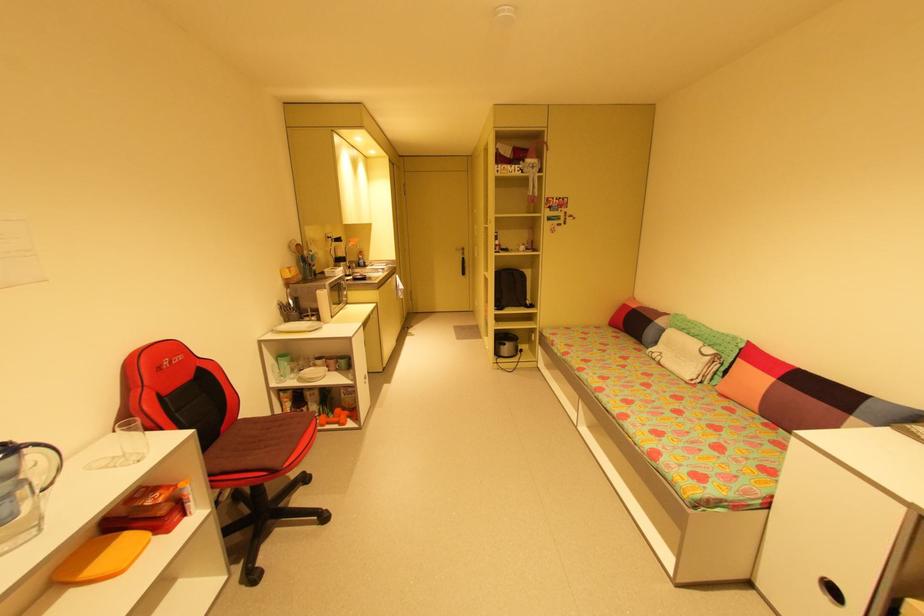
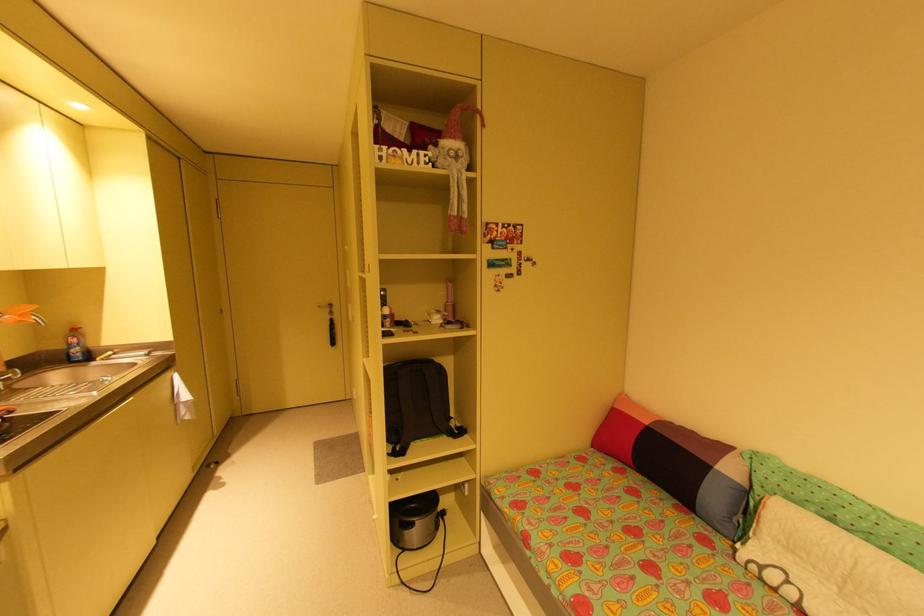
Where in the second image is the point corresponding to (466,252) from the first image?

(333, 310)